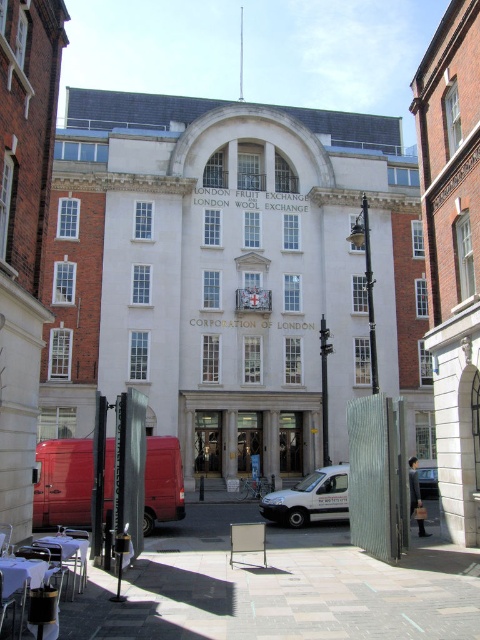
Who is higher up, white matte van at center or metallic silver table at lower left?

metallic silver table at lower left

You are a GUI agent. You are given a task and a screenshot of the screen. Output one action in this format:
    pyautogui.click(x=<x>, y=<y>)
    Task: Click on the white matte van at center
    This screenshot has width=480, height=640.
    Given the screenshot: What is the action you would take?
    pyautogui.click(x=310, y=499)

Is wooden table at lower left to the right of polished brass door at center from the viewer's perspective?

In fact, wooden table at lower left is to the left of polished brass door at center.

Who is more forward, (31, 576) or (204, 456)?

Point (31, 576) is in front.

Measure the distance between wooden table at lower left and camera.

They are 65.49 feet apart.

Find the location of a particular element. This screenshot has width=480, height=640. wooden table at lower left is located at coordinates (22, 577).

Consider the image. Between metallic silver table at lower left and metallic silver van at center, which one is positioned higher?

metallic silver table at lower left is above.

Does metallic silver table at lower left have a lesser width compared to metallic silver van at center?

Yes, metallic silver table at lower left is thinner than metallic silver van at center.

Is point (76, 561) in front of point (434, 484)?

Yes, it is in front of point (434, 484).

Identify the location of metallic silver table at lower left. The height and width of the screenshot is (640, 480). (69, 556).